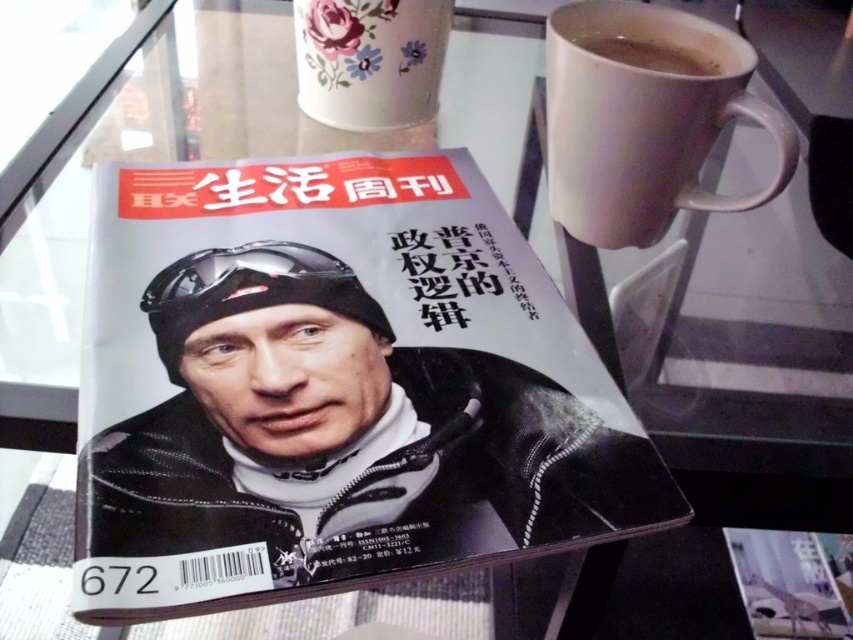
You are a delivery person who needs to place a small package between the white matte mug at upper right and the floral ceramic mug at upper center. The package is 20 centimeters long. Will it fit between them?

The distance between the white matte mug at upper right and the floral ceramic mug at upper center is 19.88 centimeters. Since the package is 20 centimeters long, it will not fit between them as the space is slightly smaller than the package.

You are holding a 10 cm ruler. If you want to measure the distance between yourself and the floral ceramic mug at upper center, how many rulers would you need to span that distance?

The distance between you and the floral ceramic mug at upper center is 59.94 centimeters. Since each ruler is 10 cm, you would need approximately 6 rulers to span the distance.